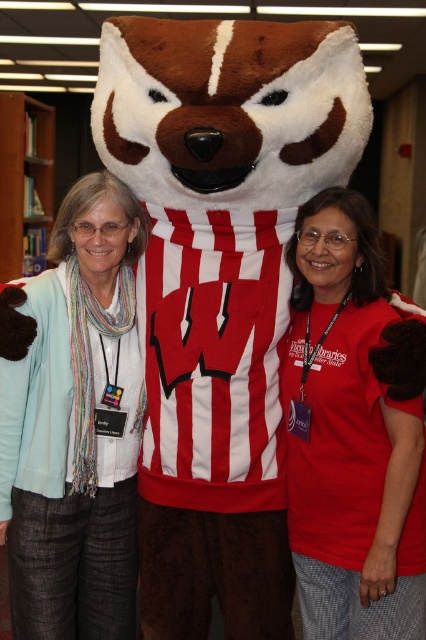
In the scene shown: You are a photographer trying to capture a detailed shot of the mascot. You notice a specific point at coordinates (353, 429) in the image. Based on the scene description, can you determine what object this point is located on?

The point at coordinates (353, 429) is located on the matte red shirt at center.

You are a photographer setting up a camera at eye level with the light blue cardigan at left and the matte red shirt at center. Which object is closer to the camera?

The matte red shirt at center is located below the light blue cardigan at left, so the light blue cardigan at left is closer to the camera.

You are standing at the point labeled as point (331, 202) in the image. A friend is located 1.90 meters away from you in the direction facing the viewer. Can you see the University of Wisconsin mascot in your line of sight?

Yes, since the point labeled (331, 202) is 1.90 meters away from the viewer, and the mascot is positioned centrally in the image, your line of sight would include the mascot.